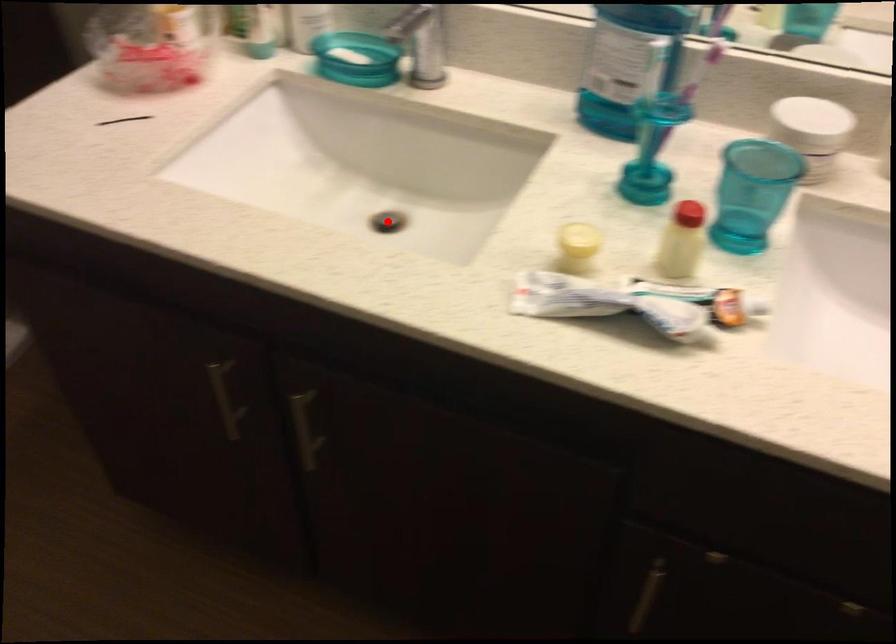
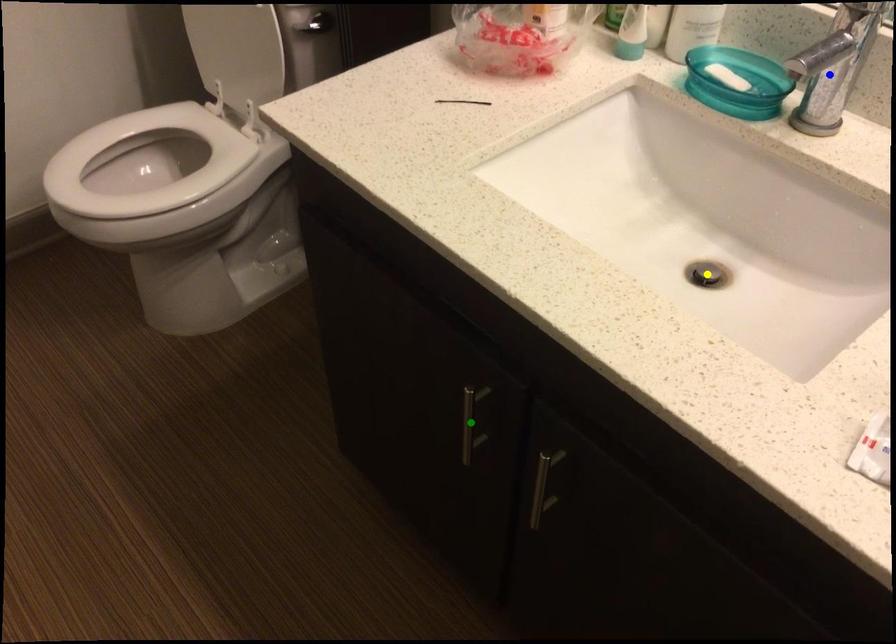
Question: I am providing you with two images of the same scene from different viewpoints. A red point is marked on the first image. You are given multiple points on the second image. Which mark in image 2 goes with the point in image 1?

Choices:
 (A) blue point
 (B) green point
 (C) yellow point

Answer: (C)